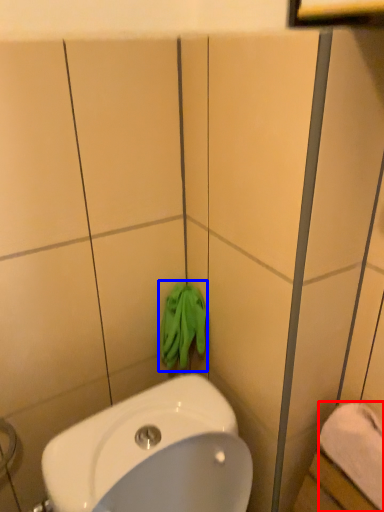
Question: Which point is further to the camera, towel/napkin (highlighted by a red box) or bath towel (highlighted by a blue box)?

Choices:
 (A) towel/napkin
 (B) bath towel

Answer: (B)